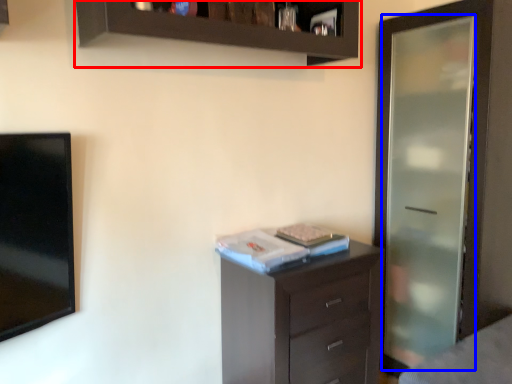
Question: Among these objects, which one is farthest to the camera, cupboard (highlighted by a red box) or screen door (highlighted by a blue box)?

Choices:
 (A) cupboard
 (B) screen door

Answer: (B)